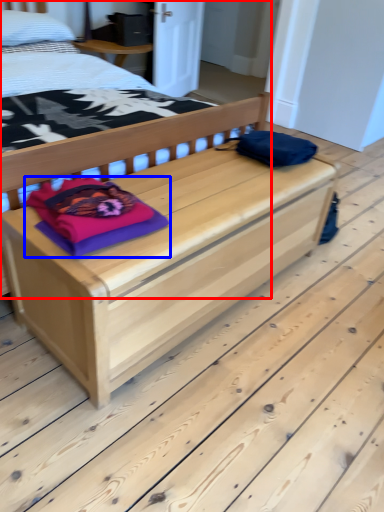
Question: Which of the following is the farthest to the observer, bed (highlighted by a red box) or material (highlighted by a blue box)?

Choices:
 (A) bed
 (B) material

Answer: (B)